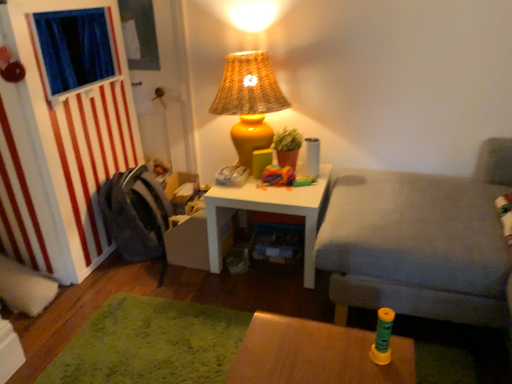
Question: From the image's perspective, is gray fabric couch at right on top of gray fabric swivel chair at left?

Choices:
 (A) yes
 (B) no

Answer: (A)

Question: Would you say gray fabric couch at right contains gray fabric swivel chair at left?

Choices:
 (A) yes
 (B) no

Answer: (B)

Question: Is gray fabric swivel chair at left at the back of gray fabric couch at right?

Choices:
 (A) yes
 (B) no

Answer: (B)

Question: Does gray fabric couch at right have a greater width compared to gray fabric swivel chair at left?

Choices:
 (A) no
 (B) yes

Answer: (B)

Question: From the image's perspective, would you say gray fabric couch at right is shown under gray fabric swivel chair at left?

Choices:
 (A) no
 (B) yes

Answer: (A)

Question: Does gray fabric couch at right come behind gray fabric swivel chair at left?

Choices:
 (A) no
 (B) yes

Answer: (A)

Question: Is gray fabric couch at right located outside yellow wicker lampshade at upper center?

Choices:
 (A) no
 (B) yes

Answer: (B)

Question: From the image's perspective, would you say gray fabric couch at right is positioned over yellow wicker lampshade at upper center?

Choices:
 (A) yes
 (B) no

Answer: (B)

Question: Is the position of gray fabric couch at right less distant than that of yellow wicker lampshade at upper center?

Choices:
 (A) no
 (B) yes

Answer: (B)

Question: Does gray fabric couch at right turn towards yellow wicker lampshade at upper center?

Choices:
 (A) yes
 (B) no

Answer: (A)

Question: Does gray fabric couch at right have a lesser width compared to yellow wicker lampshade at upper center?

Choices:
 (A) no
 (B) yes

Answer: (A)

Question: Is gray fabric couch at right far away from yellow wicker lampshade at upper center?

Choices:
 (A) yes
 (B) no

Answer: (B)

Question: Is white matte table at center, which is the 1th table in back-to-front order, oriented away from gray fabric couch at right?

Choices:
 (A) yes
 (B) no

Answer: (B)